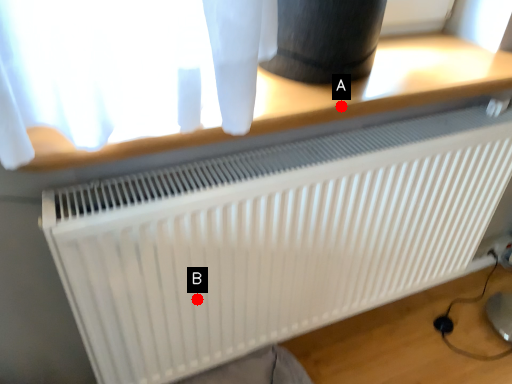
Question: Two points are circled on the image, labeled by A and B beside each circle. Which point is further to the camera?

Choices:
 (A) A is further
 (B) B is further

Answer: (B)